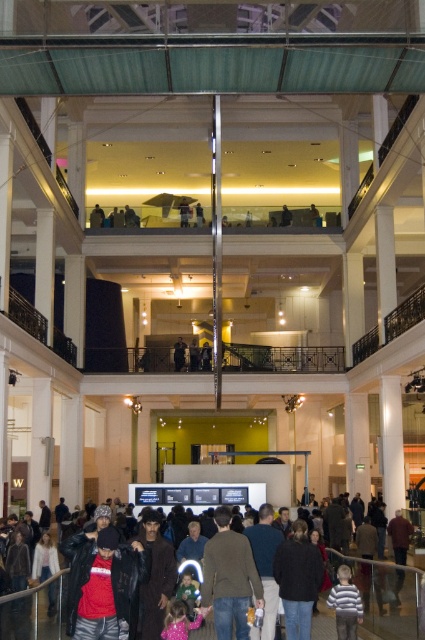
You are standing at the entrance of the museum and see two points marked in the image. The first point is at coordinate point (25, 637) and the second is at point (348, 602). If you want to reach the second point, which direction should you move relative to the first point?

To reach the second point at (348, 602) from the first point at (25, 637), you should move backward since point (25, 637) is in front of point (348, 602).

You are standing at the entrance of the museum and see the dark clothing crowd at center and the striped sweater at lower right. Which object is located to the right of the other?

The striped sweater at lower right is located to the right of the dark clothing crowd at center.

In the scene shown: You are standing in the museum and want to take a photo of both the point at coordinates (3,616) and the point at coordinates (249,561). Which point should you focus on first to ensure both are in clear view?

You should focus on point (3,616) first because it is closer to you than point (249,561), ensuring both points remain in clear view.